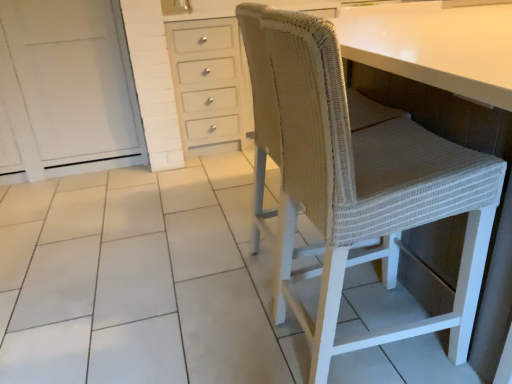
Question: Is woven beige chair at right closer to camera compared to white painted wood cabinet at left?

Choices:
 (A) yes
 (B) no

Answer: (A)

Question: Considering the relative positions of woven beige chair at right and white painted wood cabinet at left in the image provided, is woven beige chair at right to the left of white painted wood cabinet at left from the viewer's perspective?

Choices:
 (A) yes
 (B) no

Answer: (B)

Question: From the image's perspective, is woven beige chair at right on white painted wood cabinet at left?

Choices:
 (A) yes
 (B) no

Answer: (B)

Question: From the image's perspective, does woven beige chair at right appear lower than white painted wood cabinet at left?

Choices:
 (A) no
 (B) yes

Answer: (B)

Question: Can you confirm if woven beige chair at right is wider than white painted wood cabinet at left?

Choices:
 (A) no
 (B) yes

Answer: (A)

Question: Is woven beige chair at right positioned far away from white painted wood cabinet at left?

Choices:
 (A) yes
 (B) no

Answer: (A)

Question: Is white painted wood cabinet at left to the left of woven beige chair at right from the viewer's perspective?

Choices:
 (A) no
 (B) yes

Answer: (B)

Question: Considering the relative positions of white painted wood cabinet at left and woven beige chair at right in the image provided, is white painted wood cabinet at left to the right of woven beige chair at right from the viewer's perspective?

Choices:
 (A) yes
 (B) no

Answer: (B)

Question: Would you consider white painted wood cabinet at left to be distant from woven beige chair at right?

Choices:
 (A) no
 (B) yes

Answer: (B)

Question: From the image's perspective, is white painted wood cabinet at left below woven beige chair at right?

Choices:
 (A) yes
 (B) no

Answer: (B)

Question: Is the depth of white painted wood cabinet at left less than that of woven beige chair at right?

Choices:
 (A) yes
 (B) no

Answer: (B)

Question: Is white painted wood cabinet at left next to woven beige chair at right?

Choices:
 (A) yes
 (B) no

Answer: (B)

Question: From their relative heights in the image, would you say white painted wood cabinet at left is taller or shorter than woven beige chair at right?

Choices:
 (A) tall
 (B) short

Answer: (A)